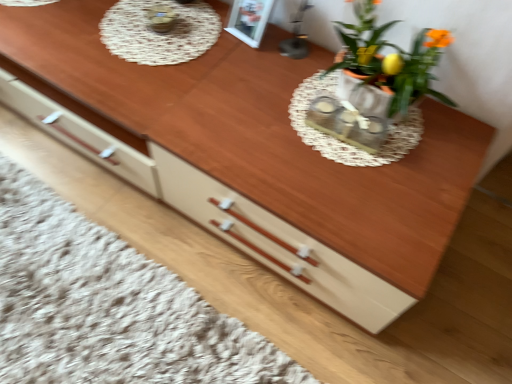
Question: Can you confirm if matte orange pot at upper right is taller than matte white flowerpot at upper right?

Choices:
 (A) no
 (B) yes

Answer: (B)

Question: Is matte orange pot at upper right positioned far away from matte white flowerpot at upper right?

Choices:
 (A) yes
 (B) no

Answer: (B)

Question: Is matte orange pot at upper right to the right of matte white flowerpot at upper right from the viewer's perspective?

Choices:
 (A) no
 (B) yes

Answer: (A)

Question: Considering the relative sizes of matte orange pot at upper right and matte white flowerpot at upper right in the image provided, is matte orange pot at upper right thinner than matte white flowerpot at upper right?

Choices:
 (A) yes
 (B) no

Answer: (B)

Question: Is matte white flowerpot at upper right located within matte orange pot at upper right?

Choices:
 (A) no
 (B) yes

Answer: (B)

Question: Is matte orange pot at upper right wider than matte white flowerpot at upper right?

Choices:
 (A) yes
 (B) no

Answer: (A)

Question: Does white lace doily at upper center have a greater width compared to matte white flowerpot at upper right?

Choices:
 (A) yes
 (B) no

Answer: (A)

Question: Is white lace doily at upper center outside matte white flowerpot at upper right?

Choices:
 (A) yes
 (B) no

Answer: (A)

Question: From the image's perspective, is white lace doily at upper center located beneath matte white flowerpot at upper right?

Choices:
 (A) yes
 (B) no

Answer: (B)

Question: Considering the relative sizes of white lace doily at upper center and matte white flowerpot at upper right in the image provided, is white lace doily at upper center taller than matte white flowerpot at upper right?

Choices:
 (A) yes
 (B) no

Answer: (B)

Question: Does white lace doily at upper center come in front of matte white flowerpot at upper right?

Choices:
 (A) no
 (B) yes

Answer: (A)

Question: Considering the relative sizes of white lace doily at upper center and matte white flowerpot at upper right in the image provided, is white lace doily at upper center smaller than matte white flowerpot at upper right?

Choices:
 (A) no
 (B) yes

Answer: (B)

Question: Considering the relative sizes of matte white flowerpot at upper right and white lace doily at upper center in the image provided, is matte white flowerpot at upper right smaller than white lace doily at upper center?

Choices:
 (A) yes
 (B) no

Answer: (B)